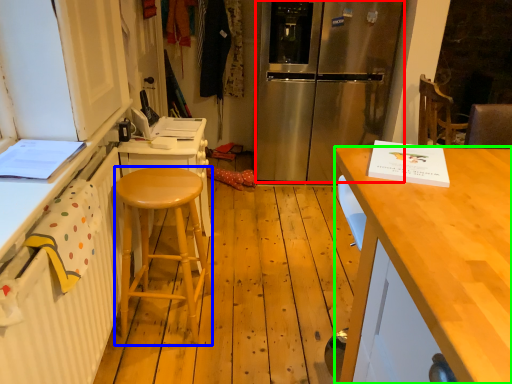
Question: Which object is the farthest from refrigerator (highlighted by a red box)? Choose among these: stool (highlighted by a blue box) or desk (highlighted by a green box).

Choices:
 (A) stool
 (B) desk

Answer: (B)